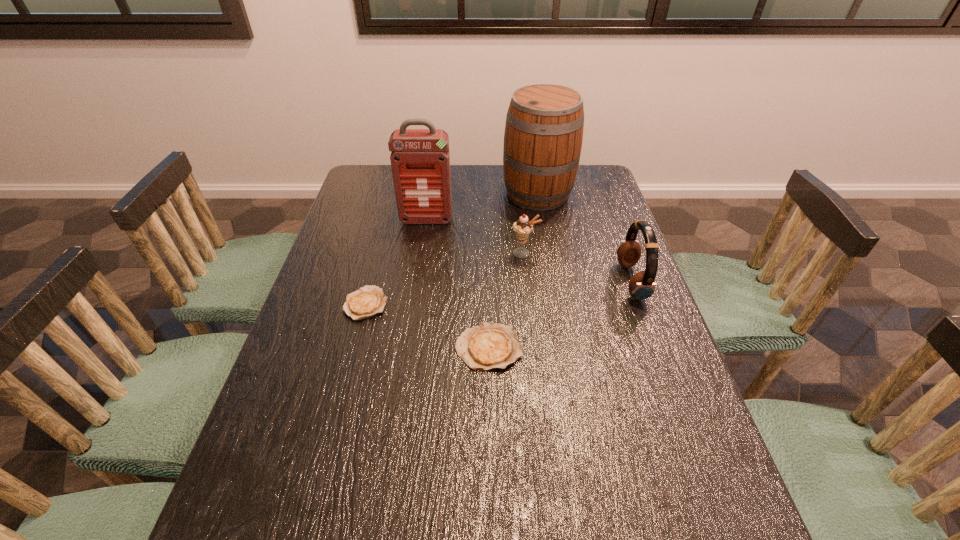
This screenshot has width=960, height=540. I want to click on vacant point located on the front-facing side of the first-aid kit, so click(413, 309).

I want to click on free point located 0.150m on the front of the farthest object, so click(546, 242).

Identify the location of vacant space located on the ear cup of the headset. (514, 282).

Locate an element on the screen. This screenshot has width=960, height=540. vacant space situated 0.260m on the ear cup of the headset is located at coordinates pos(525,282).

Find the location of a particular element. free space located on the ear cup of the headset is located at coordinates (511, 282).

What are the coordinates of `free space located 0.280m on the back of the icecream` in the screenshot? It's located at pos(517,195).

At what (x,y) coordinates should I click in order to perform the action: click on object positioned at the far edge. Please return your answer as a coordinate pair (x, y). The width and height of the screenshot is (960, 540). Looking at the image, I should click on (543, 136).

Where is `object positioned at the left edge`? The height and width of the screenshot is (540, 960). object positioned at the left edge is located at coordinates (368, 301).

What are the coordinates of `cider that is at the right edge` in the screenshot? It's located at (543, 136).

The image size is (960, 540). What are the coordinates of `headset present at the right edge` in the screenshot? It's located at (642, 285).